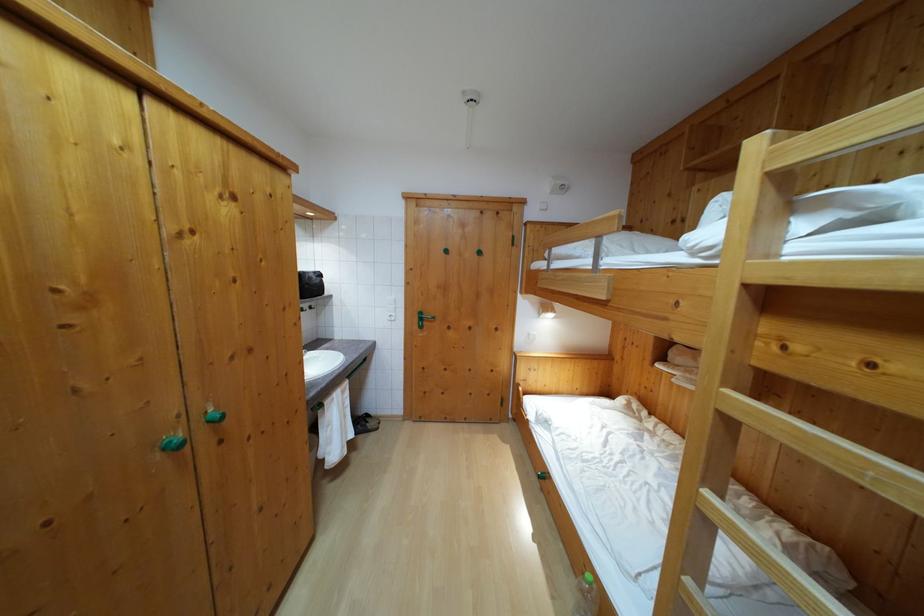
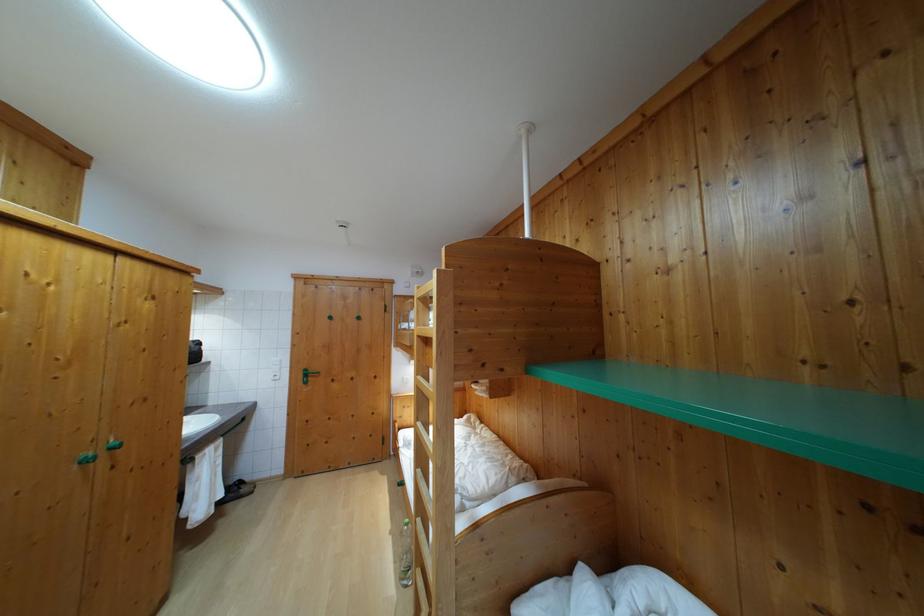
Question: How did the camera likely rotate?

Choices:
 (A) Left
 (B) Right
 (C) Up
 (D) Down

Answer: (B)